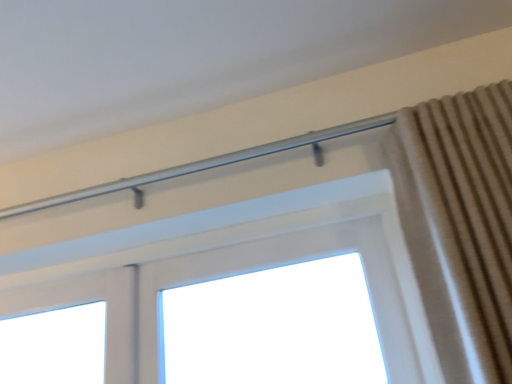
What do you see at coordinates (281, 233) in the screenshot? I see `white plastic window at center` at bounding box center [281, 233].

Identify the location of white plastic window at center. (281, 233).

This screenshot has width=512, height=384. I want to click on white plastic window at center, so click(x=281, y=233).